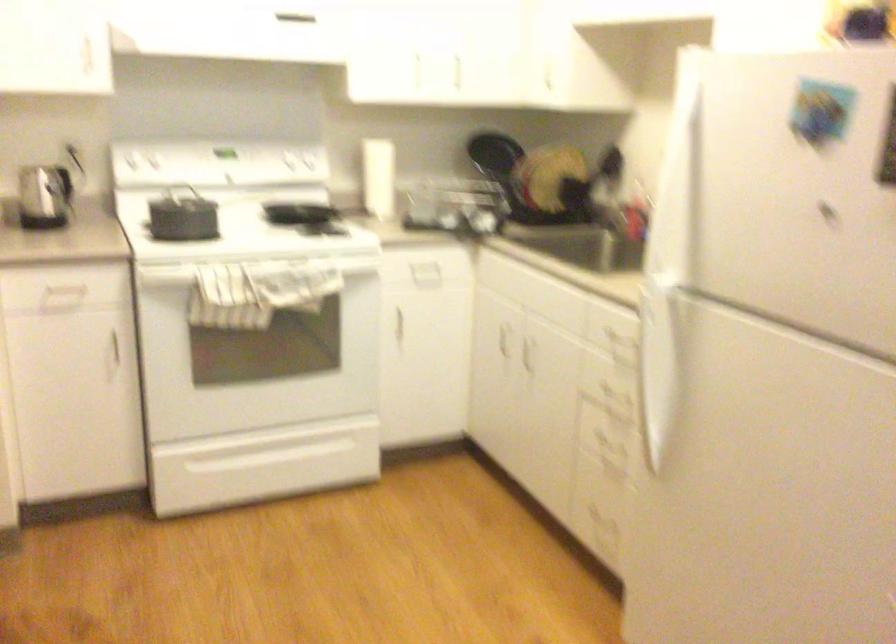
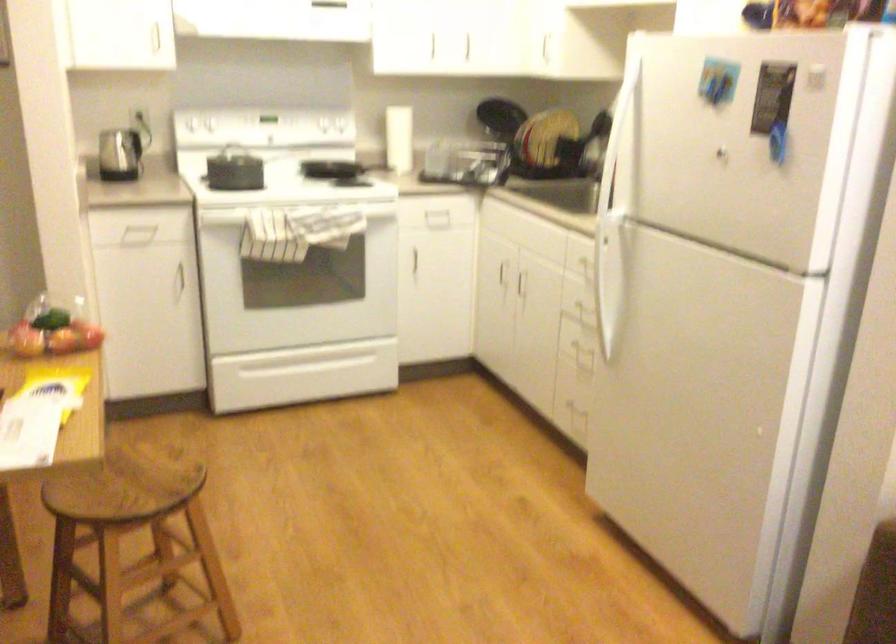
Find the pixel in the second image that matches (x=380, y=185) in the first image.

(399, 138)